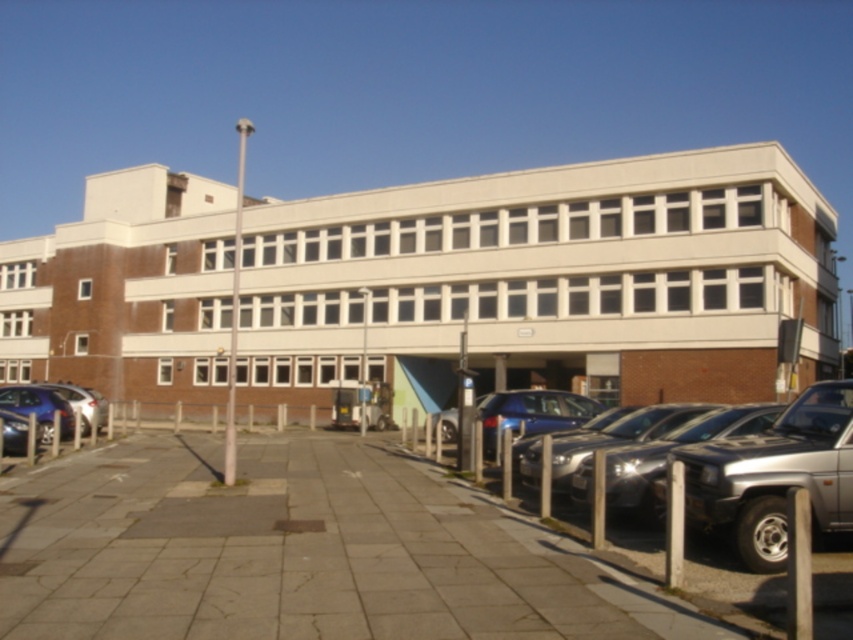
Question: Does shiny blue sedan at left have a greater width compared to matte silver car at left?

Choices:
 (A) no
 (B) yes

Answer: (A)

Question: Among these objects, which one is nearest to the camera?

Choices:
 (A) shiny blue sedan at left
 (B) silver metallic car at center right

Answer: (B)

Question: Can you confirm if shiny blue sedan at left is thinner than matte silver car at left?

Choices:
 (A) yes
 (B) no

Answer: (A)

Question: Among these objects, which one is nearest to the camera?

Choices:
 (A) silver metallic suv at right
 (B) shiny blue sedan at left

Answer: (A)

Question: Can you confirm if shiny blue sedan at left is positioned to the right of matte silver car at left?

Choices:
 (A) no
 (B) yes

Answer: (B)

Question: Which of the following is the farthest from the observer?

Choices:
 (A) (753, 570)
 (B) (74, 634)
 (C) (733, 528)
 (D) (20, 410)

Answer: (D)